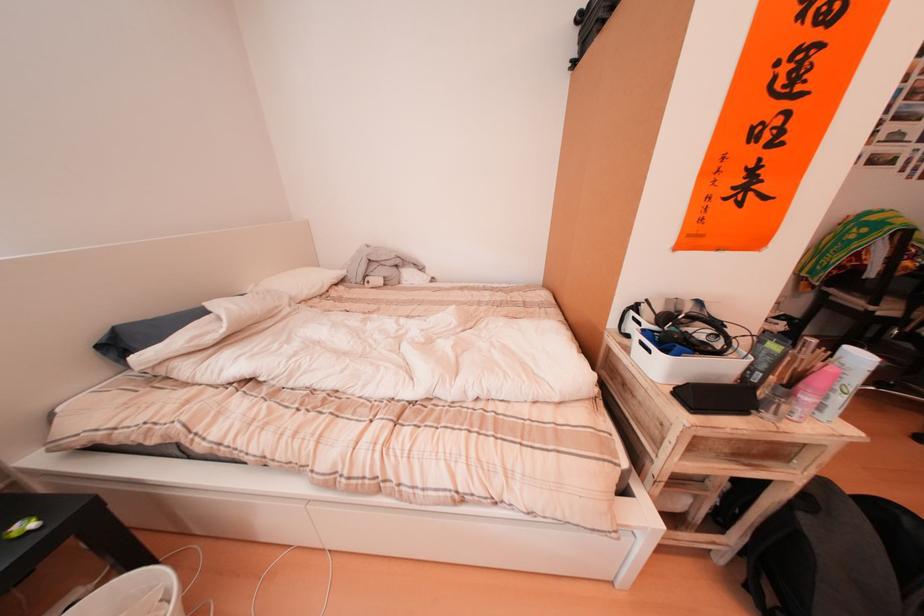
Where would you lift the white paper roll? Please return your answer as a coordinate pair (x, y).

(134, 594)